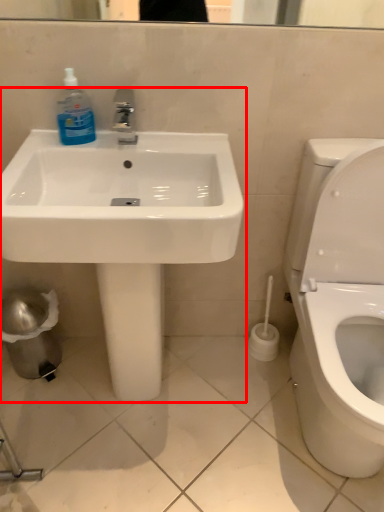
Question: Observing the image, what is the correct spatial positioning of sink (annotated by the red box) in reference to cleaning product?

Choices:
 (A) right
 (B) left

Answer: (A)